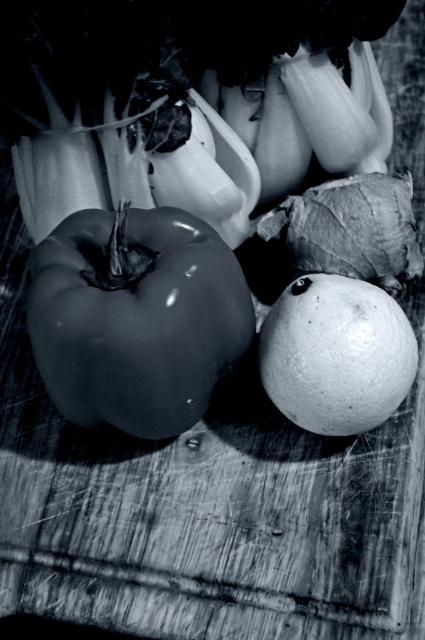
Question: Is glossy black pepper at left positioned behind smooth white orange at center?

Choices:
 (A) no
 (B) yes

Answer: (A)

Question: Can you confirm if glossy black pepper at left is positioned to the left of smooth white orange at center?

Choices:
 (A) yes
 (B) no

Answer: (A)

Question: Does glossy black pepper at left have a greater width compared to smooth white orange at center?

Choices:
 (A) no
 (B) yes

Answer: (B)

Question: Which object appears closest to the camera in this image?

Choices:
 (A) smooth white orange at center
 (B) glossy black pepper at left

Answer: (B)